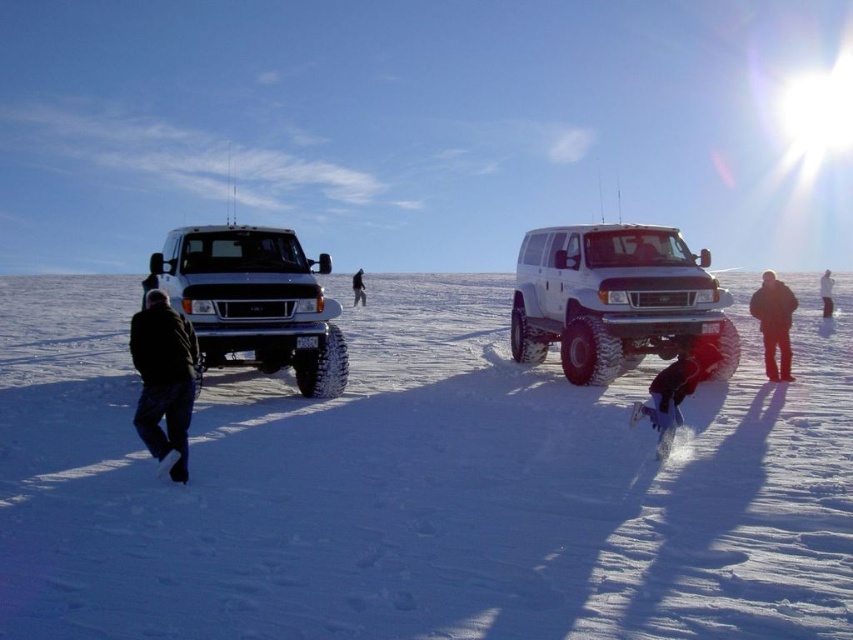
Question: Is white matte van at center positioned in front of white matte truck at left?

Choices:
 (A) yes
 (B) no

Answer: (B)

Question: Estimate the real-world distances between objects in this image. Which object is farther from the white matte truck at left?

Choices:
 (A) red snowboard at lower right
 (B) white matte van at center
 (C) white powdery snow at center

Answer: (A)

Question: Among these objects, which one is nearest to the camera?

Choices:
 (A) black fabric jacket at lower right
 (B) black woolen jacket at lower left
 (C) white matte truck at left

Answer: (B)

Question: Which object appears closest to the camera in this image?

Choices:
 (A) black woolen jacket at right
 (B) white matte van at center

Answer: (B)

Question: Does black woolen jacket at right appear over black fabric jacket at lower right?

Choices:
 (A) no
 (B) yes

Answer: (A)

Question: Does white matte van at center appear under black woolen jacket at lower left?

Choices:
 (A) no
 (B) yes

Answer: (A)